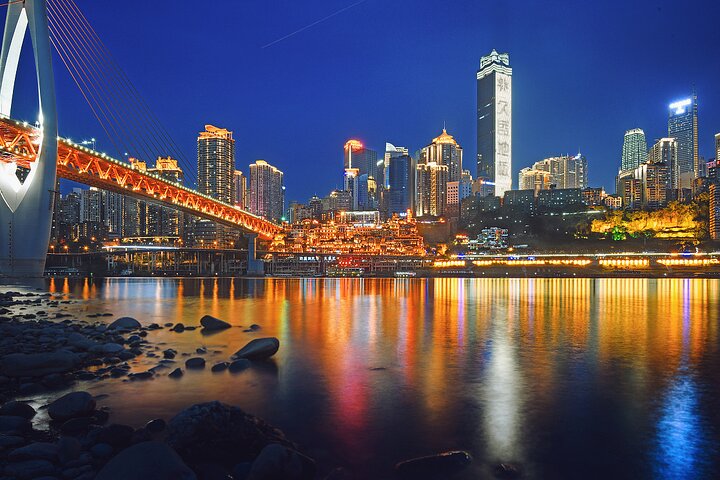
Identify the location of light. (566, 309).